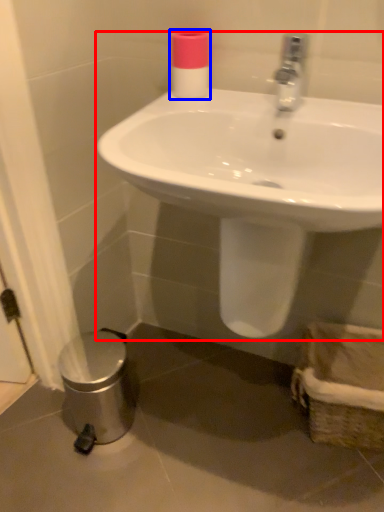
Question: Among these objects, which one is nearest to the camera, sink (highlighted by a red box) or toiletry (highlighted by a blue box)?

Choices:
 (A) sink
 (B) toiletry

Answer: (A)